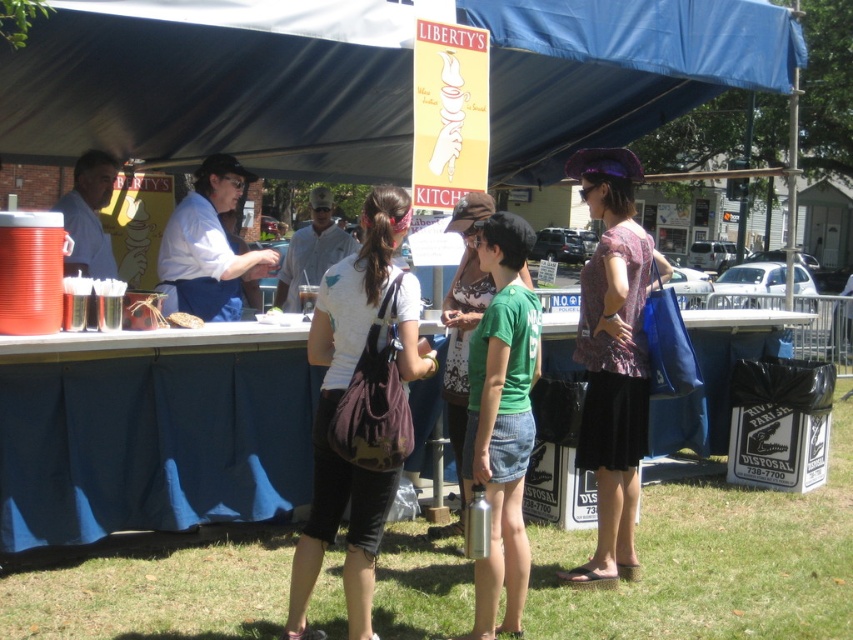
Does printed cotton blouse at center have a greater width compared to white fabric apron at center?

Correct, the width of printed cotton blouse at center exceeds that of white fabric apron at center.

Does printed cotton blouse at center have a smaller size compared to white fabric apron at center?

Incorrect, printed cotton blouse at center is not smaller in size than white fabric apron at center.

Locate an element on the screen. printed cotton blouse at center is located at coordinates (612, 356).

Can you confirm if matte white shirt at center is thinner than black matte cup at center?

In fact, matte white shirt at center might be wider than black matte cup at center.

Is matte white shirt at center wider than black matte cup at center?

Yes.

Is point (292, 298) positioned before point (300, 296)?

No, (292, 298) is behind (300, 296).

The height and width of the screenshot is (640, 853). What are the coordinates of `matte white shirt at center` in the screenshot? It's located at (311, 250).

Can you confirm if white fabric apron at center is positioned to the right of green fabric shirt at center?

No, white fabric apron at center is not to the right of green fabric shirt at center.

Locate an element on the screen. white fabric apron at center is located at coordinates (209, 244).

Where is `white fabric apron at center`? This screenshot has height=640, width=853. white fabric apron at center is located at coordinates (209, 244).